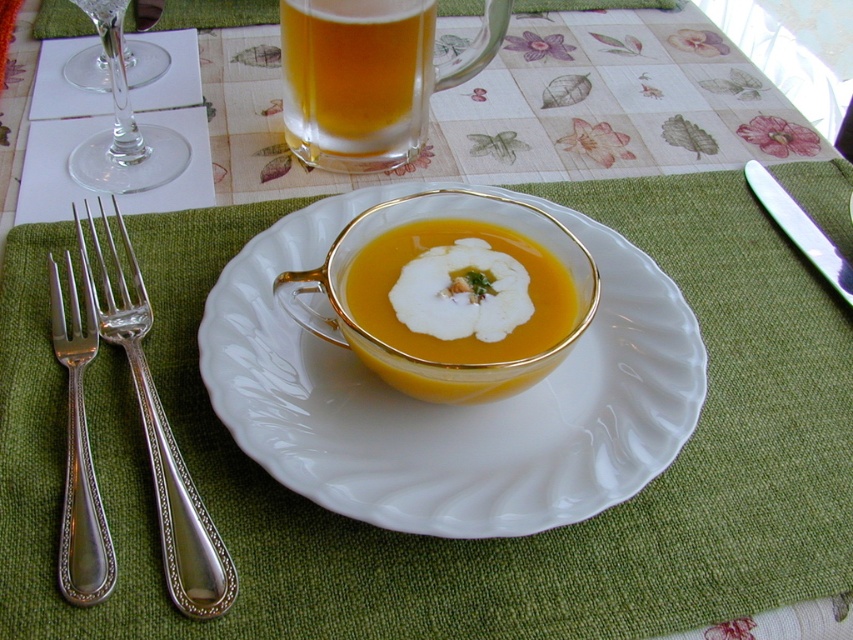
Who is taller, golden glass beer at upper center or silver polished knife at upper right?

silver polished knife at upper right

Is point (369, 157) positioned before point (786, 202)?

No, it is behind (786, 202).

Describe the element at coordinates (357, 81) in the screenshot. I see `golden glass beer at upper center` at that location.

Where is `golden glass beer at upper center`? The image size is (853, 640). golden glass beer at upper center is located at coordinates (357, 81).

Is silvermetallicfork at left to the left of transparent glass wine glass at left from the viewer's perspective?

In fact, silvermetallicfork at left is to the right of transparent glass wine glass at left.

In the scene shown: Who is more forward, (169,499) or (120,12)?

Point (169,499)

I want to click on silvermetallicfork at left, so click(x=157, y=429).

Between silvermetallicfork at left and yellow matte soup at center, which one has less height?

With less height is yellow matte soup at center.

Image resolution: width=853 pixels, height=640 pixels. What are the coordinates of `silvermetallicfork at left` in the screenshot? It's located at (157, 429).